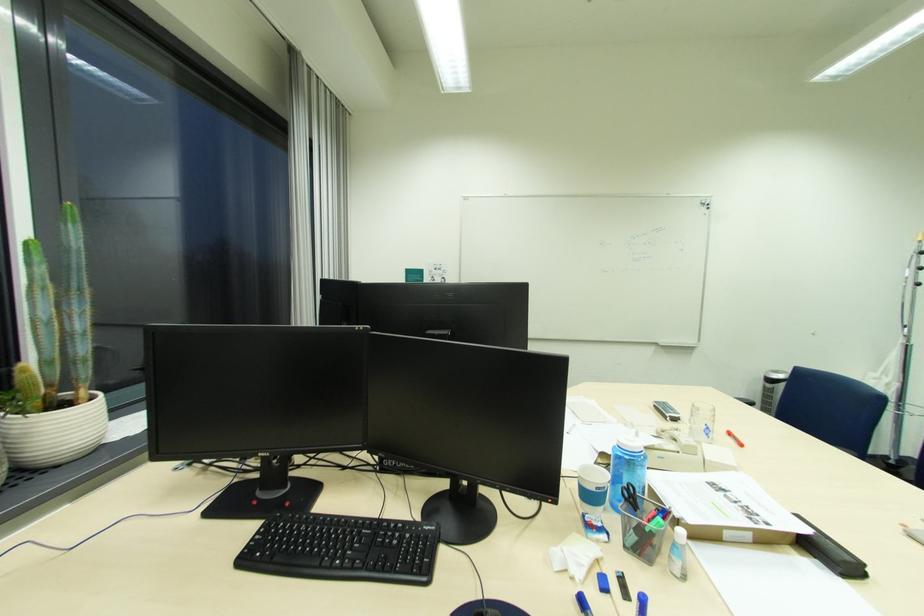
Image resolution: width=924 pixels, height=616 pixels. Describe the element at coordinates (626, 468) in the screenshot. I see `the blue water bottle` at that location.